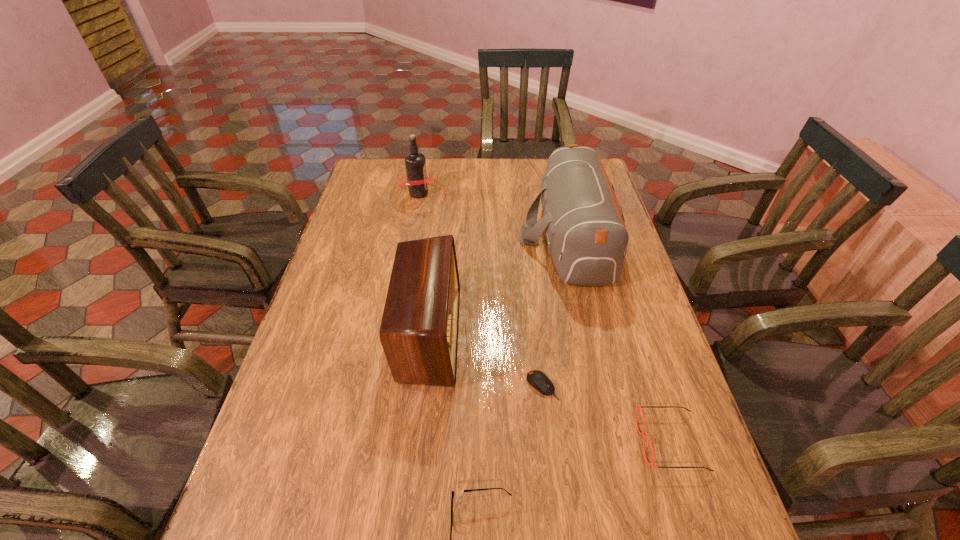
Find the location of a particular element. The height and width of the screenshot is (540, 960). free space located 0.290m on the front-facing side of the second nearest object is located at coordinates (504, 442).

Identify the location of free spot located on the front-facing side of the second nearest object. (603, 442).

You are a GUI agent. You are given a task and a screenshot of the screen. Output one action in this format:
    pyautogui.click(x=<x>, y=<y>)
    Task: Click on the vacant space located 0.110m on the left of the computer mouse
    This screenshot has height=540, width=960.
    Given the screenshot: What is the action you would take?
    pyautogui.click(x=480, y=386)

Where is `root beer present at the far edge`? The height and width of the screenshot is (540, 960). root beer present at the far edge is located at coordinates (417, 181).

The height and width of the screenshot is (540, 960). In order to click on duffel bag that is at the far edge in this screenshot , I will do (x=587, y=239).

Locate an element on the screen. The width and height of the screenshot is (960, 540). object at the left edge is located at coordinates (417, 181).

The image size is (960, 540). In order to click on duffel bag that is at the right edge in this screenshot , I will do `click(587, 239)`.

Identify the location of spectacles present at the right edge. This screenshot has height=540, width=960. (637, 408).

Find the location of a particular element. object located in the far left corner section of the desktop is located at coordinates (417, 181).

Where is `object at the far right corner`? object at the far right corner is located at coordinates (587, 239).